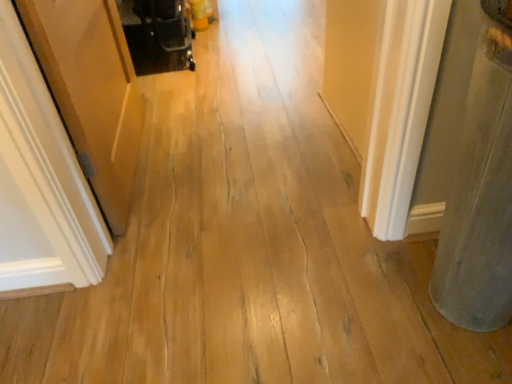
The image size is (512, 384). I want to click on vacant space to the right of black plastic baby carriage at upper left, so click(239, 36).